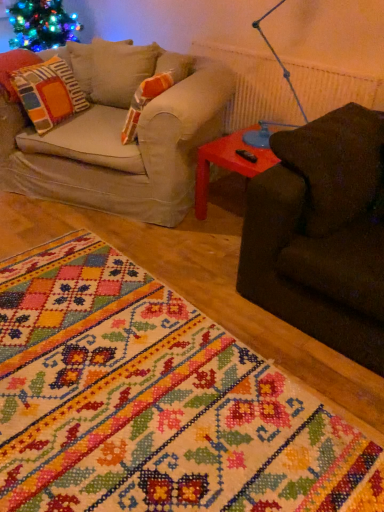
Question: Is embroidered fabric rug at lower left positioned in front of rubberized plastic side table at right?

Choices:
 (A) yes
 (B) no

Answer: (A)

Question: Considering the relative sizes of embroidered fabric rug at lower left and rubberized plastic side table at right in the image provided, is embroidered fabric rug at lower left taller than rubberized plastic side table at right?

Choices:
 (A) no
 (B) yes

Answer: (A)

Question: Is embroidered fabric rug at lower left positioned far away from rubberized plastic side table at right?

Choices:
 (A) no
 (B) yes

Answer: (B)

Question: Is embroidered fabric rug at lower left oriented away from rubberized plastic side table at right?

Choices:
 (A) no
 (B) yes

Answer: (A)

Question: From a real-world perspective, is embroidered fabric rug at lower left on rubberized plastic side table at right?

Choices:
 (A) no
 (B) yes

Answer: (A)

Question: Considering the positions of point (51, 126) and point (74, 368), is point (51, 126) closer or farther from the camera than point (74, 368)?

Choices:
 (A) closer
 (B) farther

Answer: (B)

Question: From the image's perspective, relative to embroidered fabric rug at lower left, is multicolored fabric pillow at left above or below?

Choices:
 (A) below
 (B) above

Answer: (B)

Question: From a real-world perspective, is multicolored fabric pillow at left physically located above or below embroidered fabric rug at lower left?

Choices:
 (A) below
 (B) above

Answer: (B)

Question: Is multicolored fabric pillow at left in front of or behind embroidered fabric rug at lower left in the image?

Choices:
 (A) behind
 (B) front

Answer: (A)

Question: From the image's perspective, is multicolored fabric pillow at left located above or below rubberized plastic side table at right?

Choices:
 (A) below
 (B) above

Answer: (B)

Question: From a real-world perspective, is multicolored fabric pillow at left physically located above or below rubberized plastic side table at right?

Choices:
 (A) above
 (B) below

Answer: (A)

Question: Is multicolored fabric pillow at left inside or outside of rubberized plastic side table at right?

Choices:
 (A) inside
 (B) outside

Answer: (B)

Question: Is point (49, 79) closer or farther from the camera than point (205, 205)?

Choices:
 (A) farther
 (B) closer

Answer: (B)

Question: Relative to embroidered fabric rug at lower left, is rubberized plastic side table at right in front or behind?

Choices:
 (A) behind
 (B) front

Answer: (A)

Question: From a real-world perspective, is rubberized plastic side table at right above or below embroidered fabric rug at lower left?

Choices:
 (A) below
 (B) above

Answer: (B)